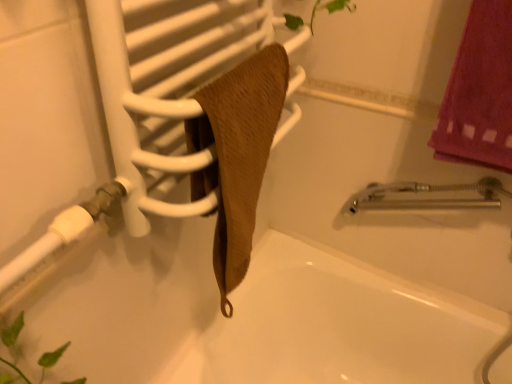
Question: Is brown textured towel at center taller or shorter than brown textured towel at center?

Choices:
 (A) short
 (B) tall

Answer: (A)

Question: Considering their positions, is brown textured towel at center located in front of or behind brown textured towel at center?

Choices:
 (A) behind
 (B) front

Answer: (B)

Question: Based on their relative distances, which object is nearer to the brown textured towel at center?

Choices:
 (A) white matte shower at lower left
 (B) white matte bathtub at center
 (C) brown textured towel at center

Answer: (C)

Question: Estimate the real-world distances between objects in this image. Which object is farther from the white matte shower at lower left?

Choices:
 (A) brown textured towel at center
 (B) white matte bathtub at center
 (C) brown textured towel at center

Answer: (B)